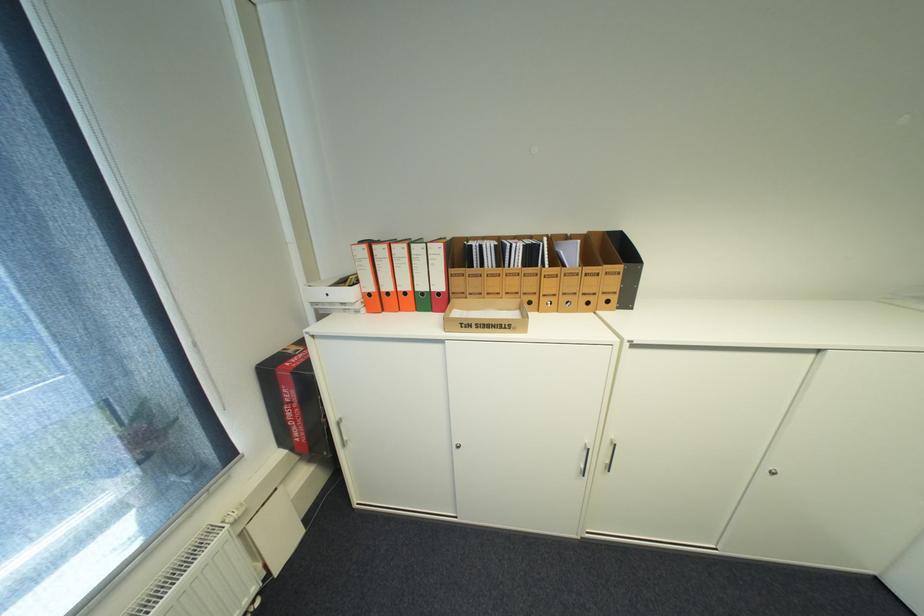
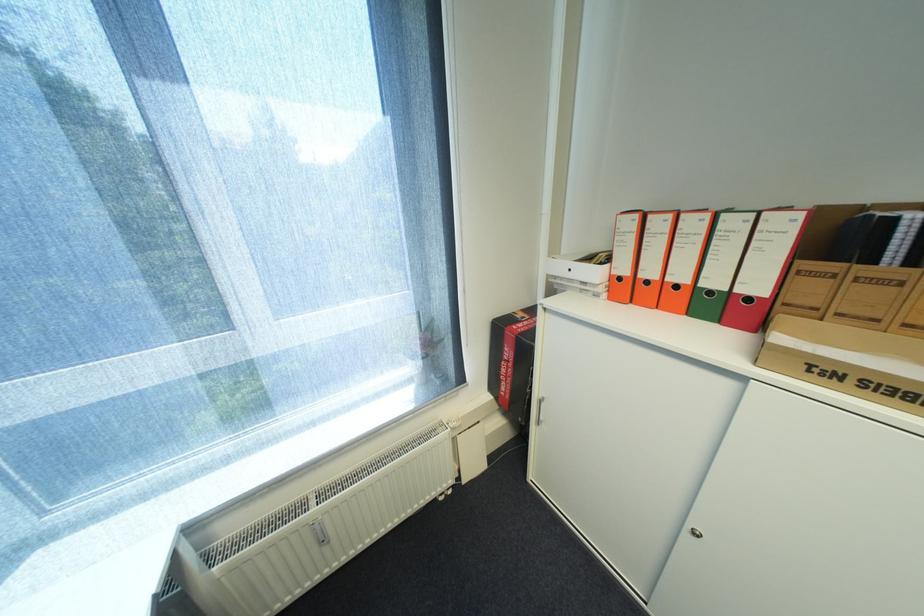
Locate, in the second image, the point that corresponds to pixel 460 281 in the first image.

(806, 282)